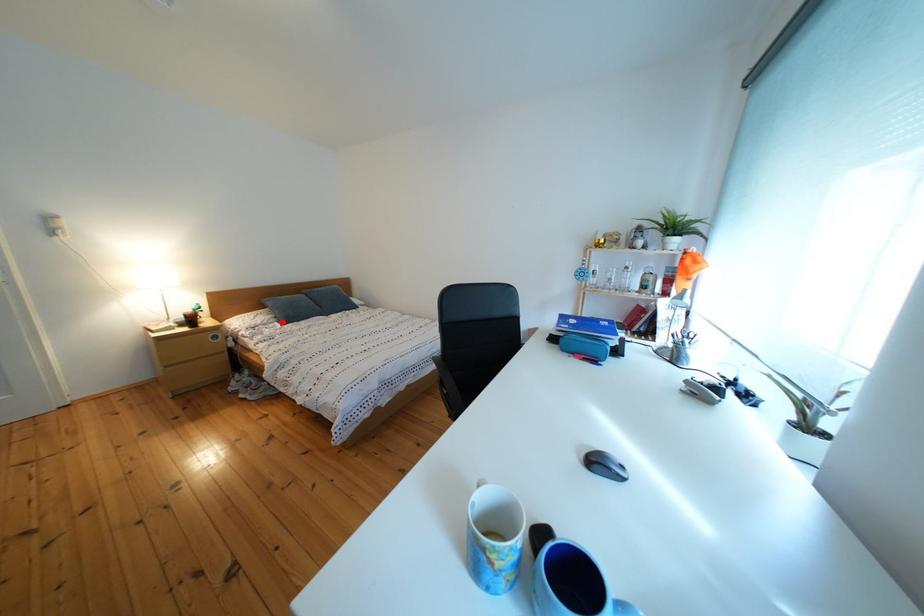
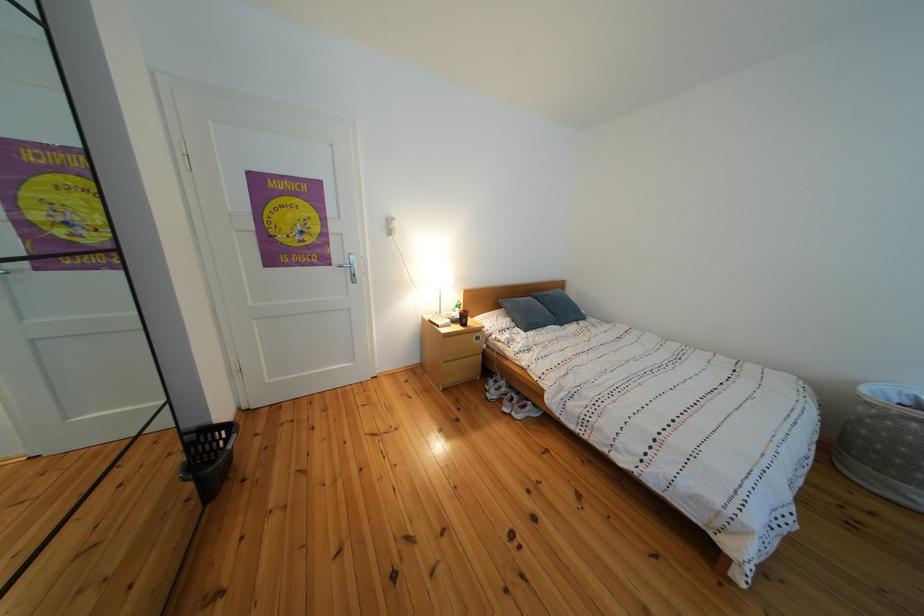
Find the pixel in the second image that matches the highlighted location in the first image.

(519, 325)